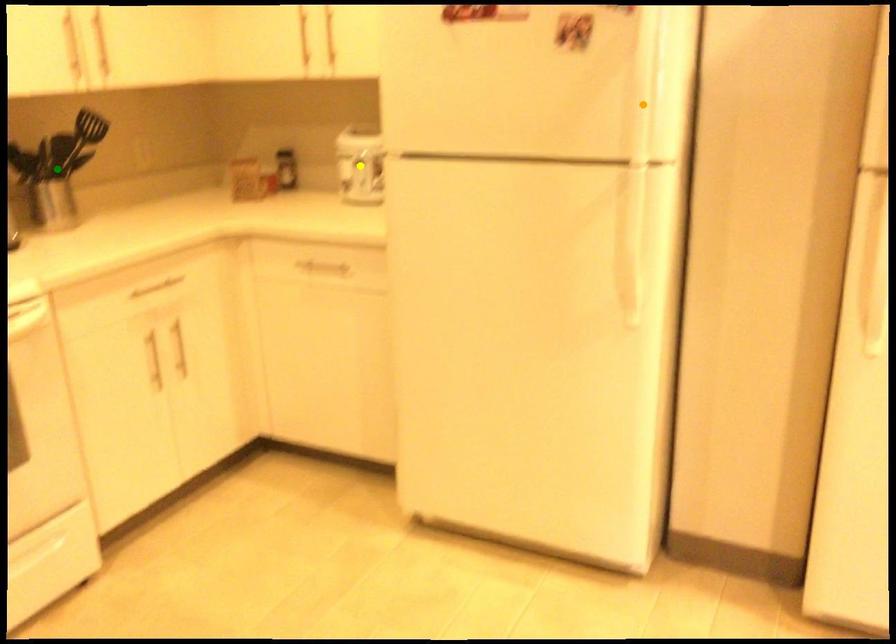
Order these from nearest to farthest:
A) green point
B) yellow point
C) orange point

green point
yellow point
orange point